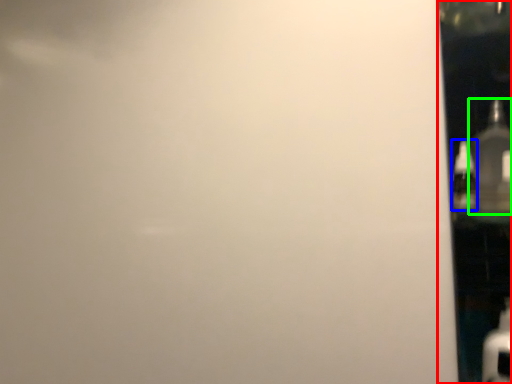
Question: Which object is positioned farthest from glass door (highlighted by a red box)? Select from bottle (highlighted by a blue box) and bottle (highlighted by a green box).

Choices:
 (A) bottle
 (B) bottle

Answer: (A)